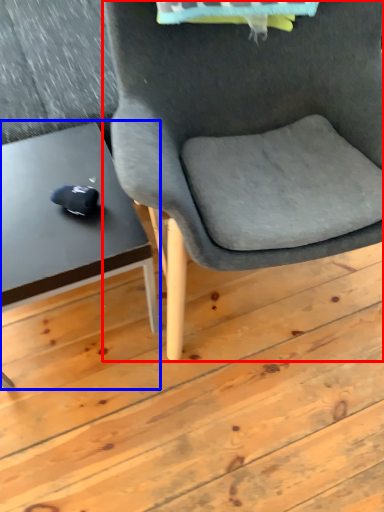
Question: Which of the following is the farthest to the observer, chair (highlighted by a red box) or table (highlighted by a blue box)?

Choices:
 (A) chair
 (B) table

Answer: (B)